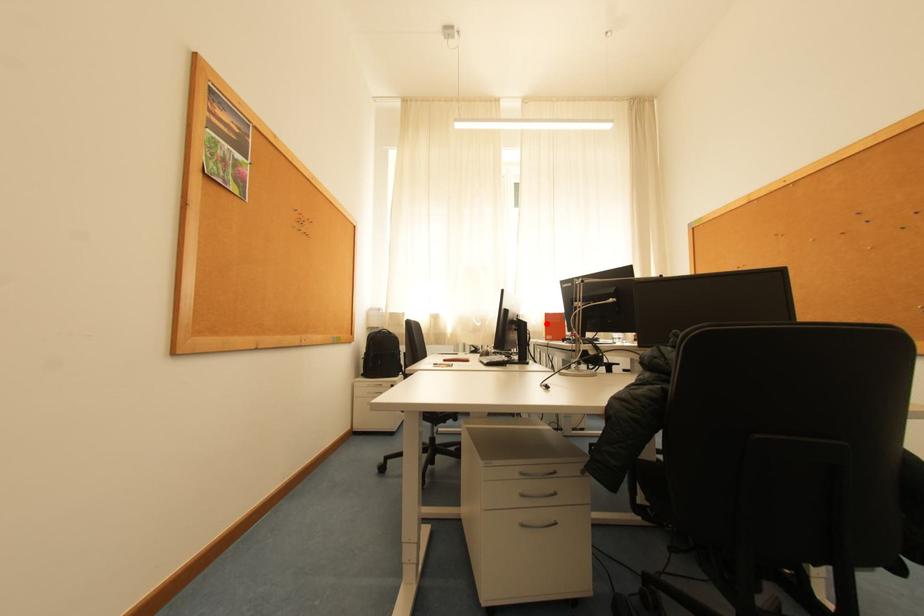
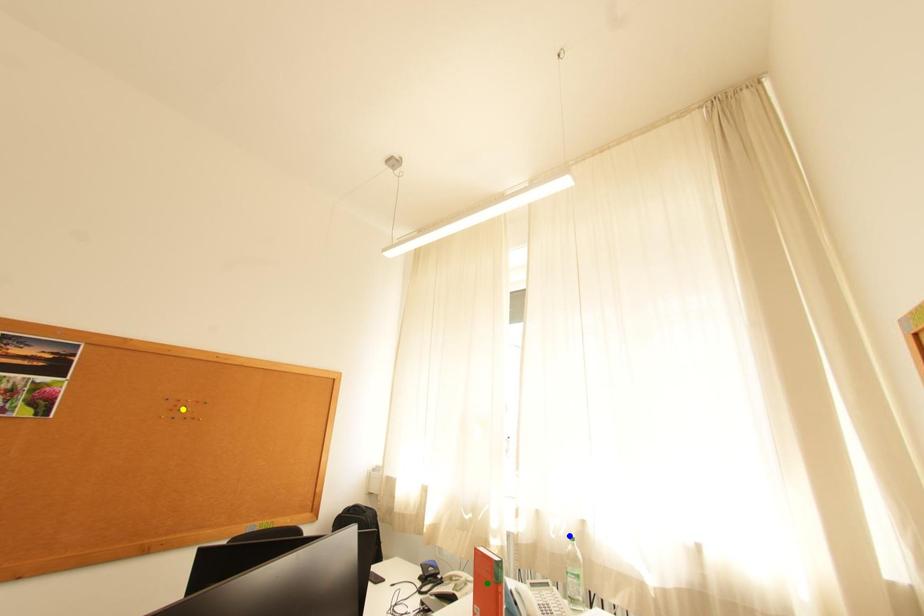
Question: I am providing you with two images of the same scene from different viewpoints. A red point is marked on the first image. You are given multiple points on the second image. Which mark in image 2 goes with the point in image 1?

Choices:
 (A) yellow point
 (B) green point
 (C) blue point

Answer: (C)